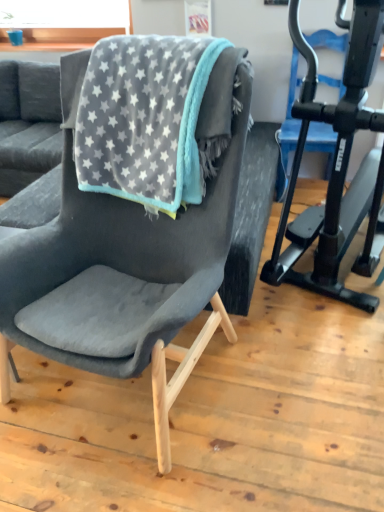
Question: From the image's perspective, is black matte stationary bicycle at right on velvet dark gray chair at center?

Choices:
 (A) no
 (B) yes

Answer: (B)

Question: Is black matte stationary bicycle at right in front of velvet dark gray chair at center?

Choices:
 (A) no
 (B) yes

Answer: (A)

Question: From a real-world perspective, does black matte stationary bicycle at right sit lower than velvet dark gray chair at center?

Choices:
 (A) no
 (B) yes

Answer: (A)

Question: Does black matte stationary bicycle at right have a greater width compared to velvet dark gray chair at center?

Choices:
 (A) no
 (B) yes

Answer: (B)

Question: From a real-world perspective, is black matte stationary bicycle at right located higher than velvet dark gray chair at center?

Choices:
 (A) yes
 (B) no

Answer: (A)

Question: Are black matte stationary bicycle at right and velvet dark gray chair at center located far from each other?

Choices:
 (A) no
 (B) yes

Answer: (A)

Question: Is velvet dark gray chair at center to the right of velvet grey blanket with star pattern at center from the viewer's perspective?

Choices:
 (A) no
 (B) yes

Answer: (A)

Question: Does velvet dark gray chair at center turn towards velvet grey blanket with star pattern at center?

Choices:
 (A) no
 (B) yes

Answer: (A)

Question: Is velvet dark gray chair at center next to velvet grey blanket with star pattern at center?

Choices:
 (A) no
 (B) yes

Answer: (A)

Question: Considering the relative positions of velvet dark gray chair at center and velvet grey blanket with star pattern at center in the image provided, is velvet dark gray chair at center to the left of velvet grey blanket with star pattern at center from the viewer's perspective?

Choices:
 (A) no
 (B) yes

Answer: (B)

Question: Considering the relative sizes of velvet dark gray chair at center and velvet grey blanket with star pattern at center in the image provided, is velvet dark gray chair at center taller than velvet grey blanket with star pattern at center?

Choices:
 (A) yes
 (B) no

Answer: (A)

Question: From a real-world perspective, is velvet dark gray chair at center on top of velvet grey blanket with star pattern at center?

Choices:
 (A) no
 (B) yes

Answer: (A)

Question: From a real-world perspective, is black matte stationary bicycle at right under velvet grey blanket with star pattern at center?

Choices:
 (A) yes
 (B) no

Answer: (A)